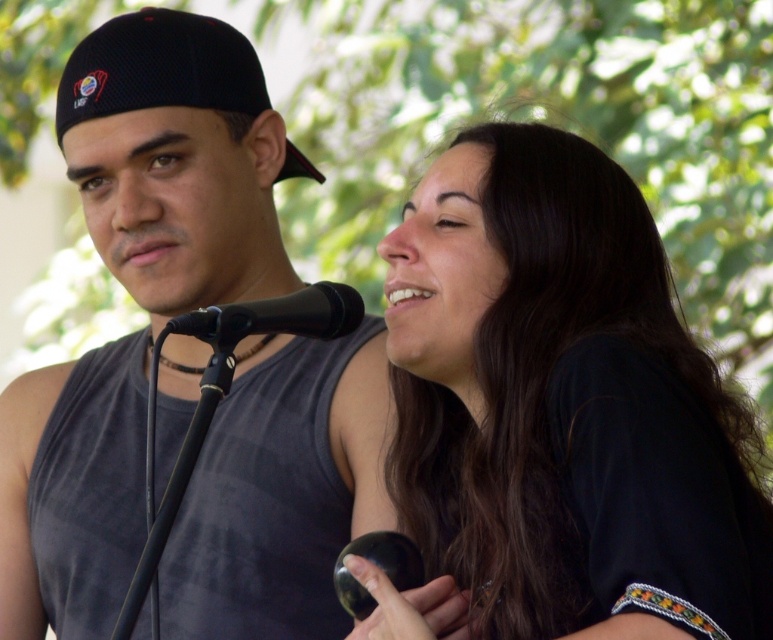
Is black matte tank top at center positioned at the back of black matte microphone at center?

Yes, it is behind black matte microphone at center.

Is point (226, 173) less distant than point (302, 317)?

That is False.

Locate an element on the screen. Image resolution: width=773 pixels, height=640 pixels. black matte tank top at center is located at coordinates (176, 161).

Does black matte hair at upper right lie behind black matte microphone at center?

No.

Which is below, black matte hair at upper right or black matte microphone at center?

black matte hair at upper right is lower down.

Is point (465, 580) behind point (305, 296)?

No, it is in front of (305, 296).

The width and height of the screenshot is (773, 640). I want to click on black matte hair at upper right, so click(x=554, y=397).

Is black matte hair at upper right above black matte tank top at center?

No.

Does black matte hair at upper right appear under black matte tank top at center?

Yes, black matte hair at upper right is below black matte tank top at center.

I want to click on black matte hair at upper right, so click(554, 397).